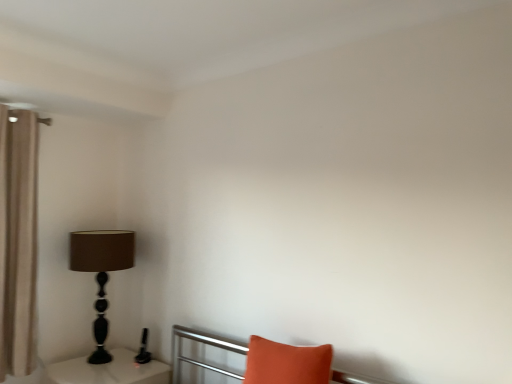
Question: Looking at their shapes, would you say matte black lamp at left is wider or thinner than white glossy table at lower left?

Choices:
 (A) thin
 (B) wide

Answer: (A)

Question: From the image's perspective, is matte black lamp at left positioned above or below white glossy table at lower left?

Choices:
 (A) above
 (B) below

Answer: (A)

Question: Based on their relative distances, which object is farther from the orange fabric pillow at lower right?

Choices:
 (A) beige fabric curtain at left
 (B) matte black lamp at left
 (C) white glossy table at lower left

Answer: (A)

Question: Considering the real-world distances, which object is farthest from the matte black lamp at left?

Choices:
 (A) orange fabric pillow at lower right
 (B) white glossy table at lower left
 (C) beige fabric curtain at left

Answer: (A)